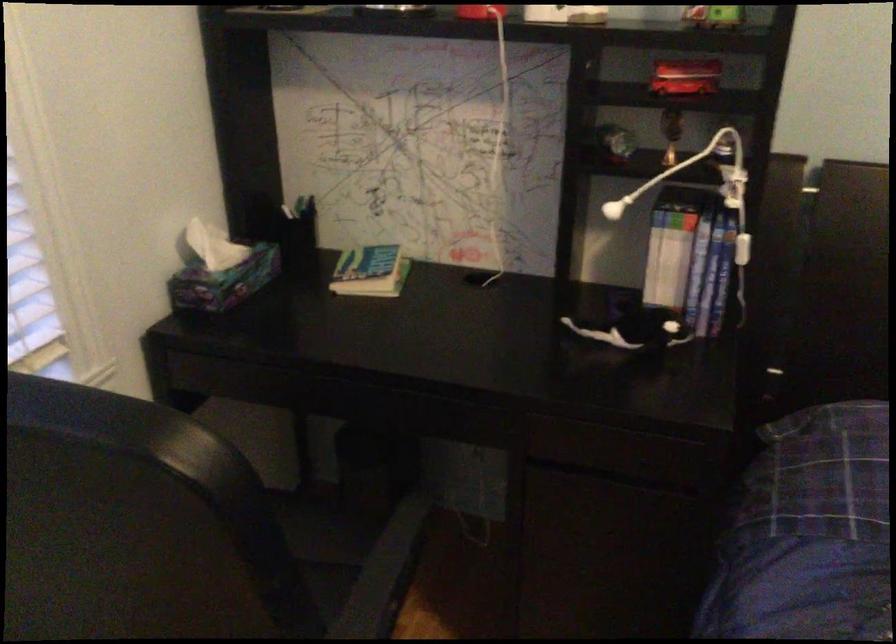
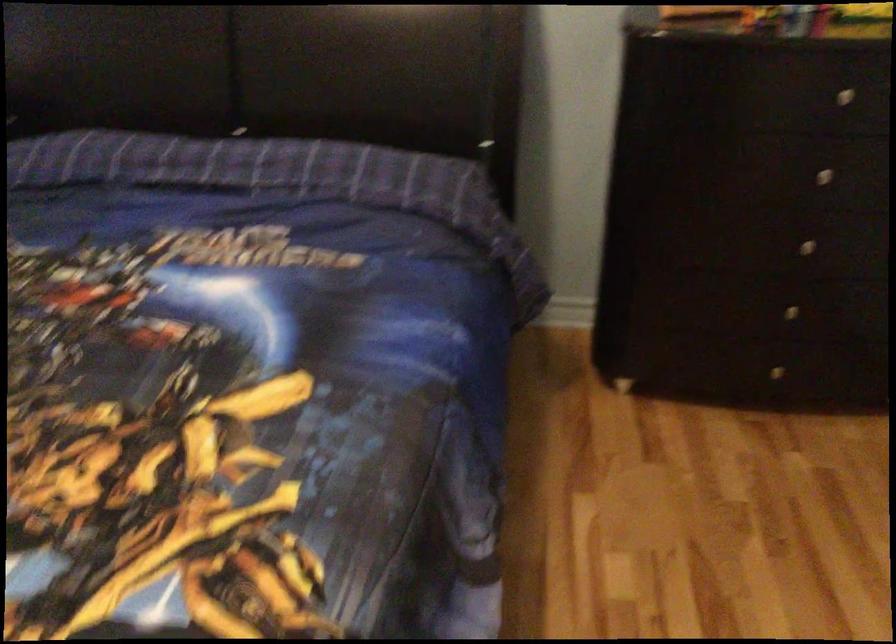
What movement of the cameraman would produce the second image?

The movement direction of the cameraman is right, backward.